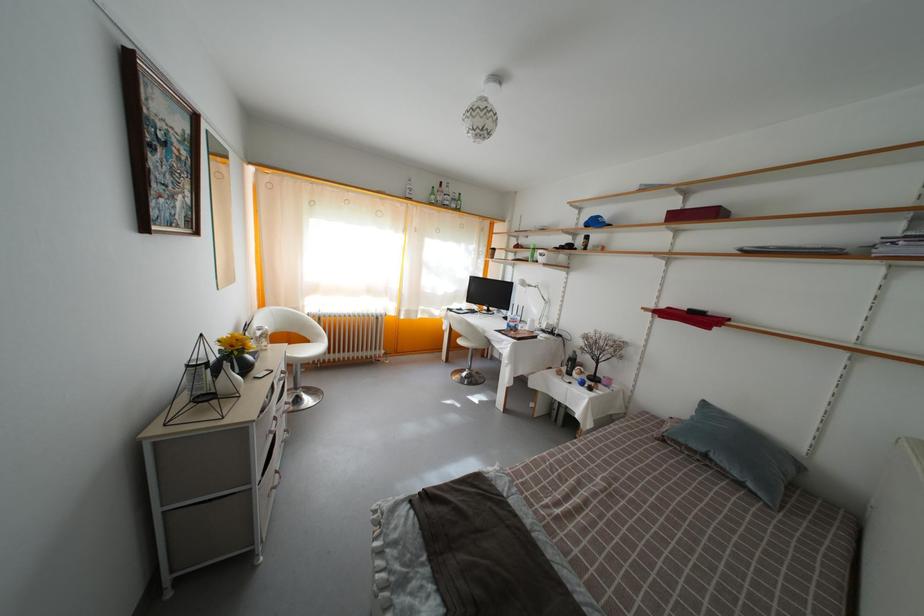
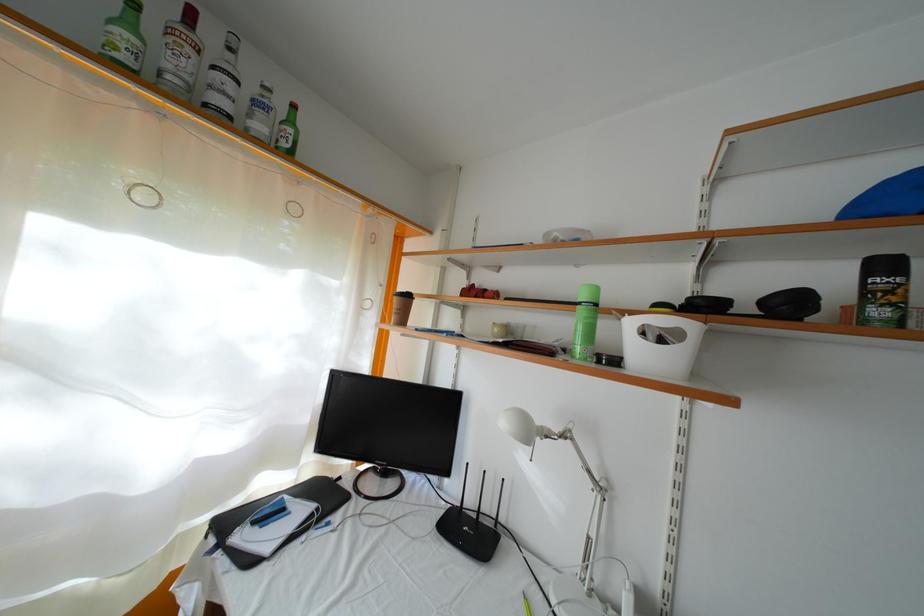
The point at (478, 318) is marked in the first image. Where is the corresponding point in the second image?

(334, 506)